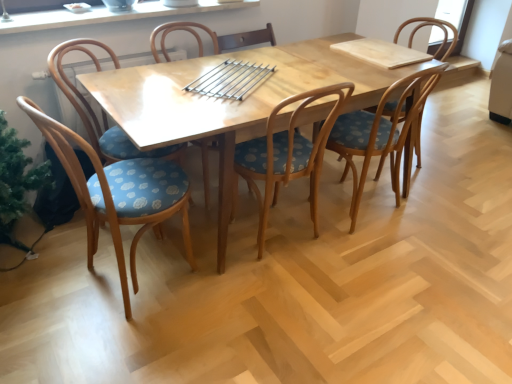
At what (x,y) coordinates should I click in order to perform the action: click on space that is in front of blue polka dot wood chair at left, which appears as the fifth chair when viewed from the right. Please return your answer as a coordinate pair (x, y). The height and width of the screenshot is (384, 512). Looking at the image, I should click on (121, 346).